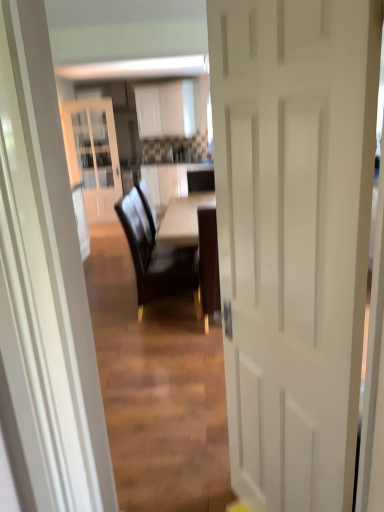
Describe the element at coordinates (294, 237) in the screenshot. I see `white matte door at center` at that location.

Locate an element on the screen. This screenshot has height=512, width=384. white matte door at center is located at coordinates (294, 237).

Measure the distance between point (190, 267) and camera.

The depth of point (190, 267) is 3.62 meters.

Measure the distance between dark brown leather chair at center and camera.

The distance of dark brown leather chair at center from camera is 3.25 meters.

What do you see at coordinates (156, 256) in the screenshot?
I see `dark brown leather chair at center` at bounding box center [156, 256].

I want to click on dark brown leather chair at center, so click(x=156, y=256).

This screenshot has height=512, width=384. What are the coordinates of `white matte door at center` in the screenshot? It's located at (294, 237).

Which object is positioned more to the left, white matte door at center or dark brown leather chair at center?

From the viewer's perspective, dark brown leather chair at center appears more on the left side.

Relative to dark brown leather chair at center, is white matte door at center in front or behind?

In the image, white matte door at center appears in front of dark brown leather chair at center.

Is point (295, 292) in front of point (200, 310)?

That is True.

From the image's perspective, between white matte door at center and dark brown leather chair at center, which one is located above?

dark brown leather chair at center is shown above in the image.

From a real-world perspective, which is physically above, white matte door at center or dark brown leather chair at center?

white matte door at center is physically above.

Considering the sizes of objects white matte door at center and dark brown leather chair at center in the image provided, who is wider, white matte door at center or dark brown leather chair at center?

With larger width is dark brown leather chair at center.

Who is taller, white matte door at center or dark brown leather chair at center?

With more height is white matte door at center.

Considering the sizes of white matte door at center and dark brown leather chair at center in the image, is white matte door at center bigger or smaller than dark brown leather chair at center?

In the image, white matte door at center appears to be smaller than dark brown leather chair at center.

Is white matte door at center inside or outside of dark brown leather chair at center?

white matte door at center is spatially situated outside dark brown leather chair at center.

Is white matte door at center not close to dark brown leather chair at center?

Indeed, white matte door at center is not near dark brown leather chair at center.

Does white matte door at center turn towards dark brown leather chair at center?

No, white matte door at center does not turn towards dark brown leather chair at center.

How different are the orientations of white matte door at center and dark brown leather chair at center in degrees?

The facing directions of white matte door at center and dark brown leather chair at center are 165 degrees apart.

Where is `chair below the white matte door at center (from a real-world perspective)`? chair below the white matte door at center (from a real-world perspective) is located at coordinates (156, 256).

Is dark brown leather chair at center at the left side of white matte door at center?

Indeed, dark brown leather chair at center is positioned on the left side of white matte door at center.

Based on the photo, between dark brown leather chair at center and white matte door at center, which one is positioned in front?

white matte door at center is more forward.

Looking at this image, which is closer to the camera, (139,225) or (361,231)?

Point (139,225) is positioned farther from the camera compared to point (361,231).

From the image's perspective, does dark brown leather chair at center appear lower than white matte door at center?

Incorrect, from the image's perspective, dark brown leather chair at center is higher than white matte door at center.

From a real-world perspective, who is located lower, dark brown leather chair at center or white matte door at center?

In real-world perspective, dark brown leather chair at center is lower.

Considering the sizes of objects dark brown leather chair at center and white matte door at center in the image provided, who is thinner, dark brown leather chair at center or white matte door at center?

white matte door at center is thinner.

Is dark brown leather chair at center taller than white matte door at center?

Incorrect, the height of dark brown leather chair at center is not larger of that of white matte door at center.

Can you confirm if dark brown leather chair at center is bigger than white matte door at center?

Indeed, dark brown leather chair at center has a larger size compared to white matte door at center.

Is dark brown leather chair at center not within white matte door at center?

dark brown leather chair at center is positioned outside white matte door at center.

Is dark brown leather chair at center with white matte door at center?

They are not placed beside each other.

Is dark brown leather chair at center oriented towards white matte door at center?

No, dark brown leather chair at center does not turn towards white matte door at center.

What's the angular difference between dark brown leather chair at center and white matte door at center's facing directions?

The angular difference between dark brown leather chair at center and white matte door at center is 165 degrees.

How distant is dark brown leather chair at center from white matte door at center?

6.97 feet.

This screenshot has width=384, height=512. Find the location of `chair to the left of white matte door at center`. chair to the left of white matte door at center is located at coordinates (156, 256).

The height and width of the screenshot is (512, 384). In order to click on chair located behind the white matte door at center in this screenshot , I will do `click(156, 256)`.

Find the location of a particular element. The height and width of the screenshot is (512, 384). chair that appears above the white matte door at center (from the image's perspective) is located at coordinates (156, 256).